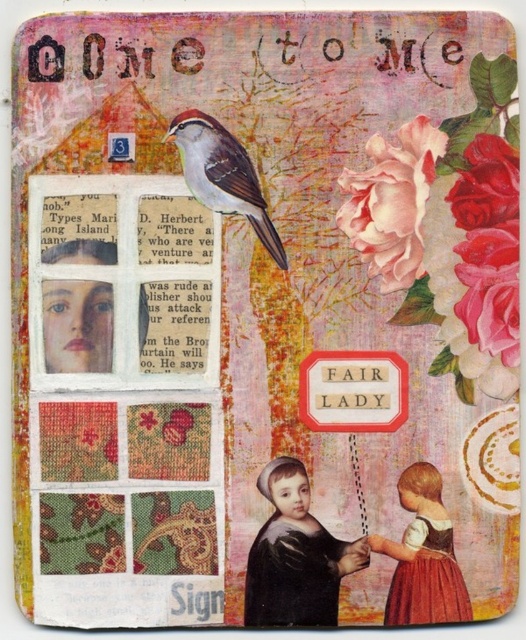
Question: Does matte brown dress at lower right come in front of matte brown bird at center?

Choices:
 (A) yes
 (B) no

Answer: (A)

Question: Is matte black portrait at center wider than matte brown dress at lower right?

Choices:
 (A) yes
 (B) no

Answer: (A)

Question: Which of the following is the closest to the observer?

Choices:
 (A) matte brown dress at lower right
 (B) matte black portrait at center
 (C) matte brown bird at center

Answer: (A)

Question: Based on their relative distances, which object is farther from the matte brown bird at center?

Choices:
 (A) matte black portrait at center
 (B) matte brown dress at lower right

Answer: (B)

Question: Is matte black portrait at center bigger than matte brown dress at lower right?

Choices:
 (A) no
 (B) yes

Answer: (B)

Question: Based on their relative distances, which object is nearer to the matte brown dress at lower right?

Choices:
 (A) matte brown bird at center
 (B) matte black portrait at center

Answer: (B)